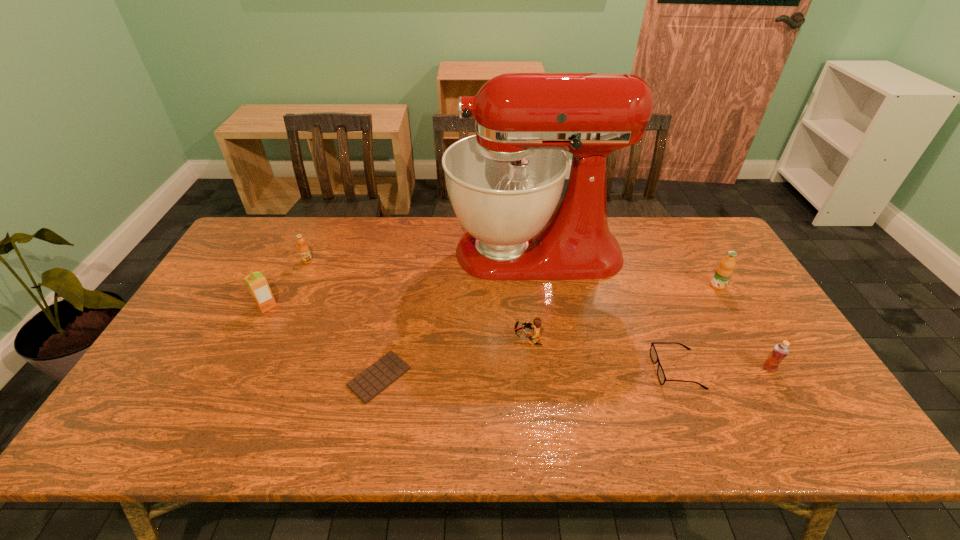
Find the location of a particular element. free space located holding a crossbow in the hands of the Lego is located at coordinates (440, 339).

Where is `free spot located 0.350m on the front-facing side of the second shortest object`? free spot located 0.350m on the front-facing side of the second shortest object is located at coordinates (515, 370).

Where is `vacant space located on the front-facing side of the second shortest object`? This screenshot has height=540, width=960. vacant space located on the front-facing side of the second shortest object is located at coordinates (595, 370).

Identify the location of vacant space positioned on the front-facing side of the second shortest object. Image resolution: width=960 pixels, height=540 pixels. [x=563, y=370].

Where is `blank space located 0.100m on the front of the chocolate bar`? The image size is (960, 540). blank space located 0.100m on the front of the chocolate bar is located at coordinates (366, 445).

Find the location of a particular element. mixer that is positioned at the far edge is located at coordinates (504, 183).

Image resolution: width=960 pixels, height=540 pixels. I want to click on orange juice present at the far edge, so click(x=303, y=249).

This screenshot has height=540, width=960. Find the location of `vacant space at the far edge of the desktop`. vacant space at the far edge of the desktop is located at coordinates 615,230.

In the image, there is a desktop. Where is `vacant space at the left edge`? Image resolution: width=960 pixels, height=540 pixels. vacant space at the left edge is located at coordinates (159, 359).

The image size is (960, 540). In the image, there is a desktop. What are the coordinates of `blank space at the far right corner` in the screenshot? It's located at (722, 243).